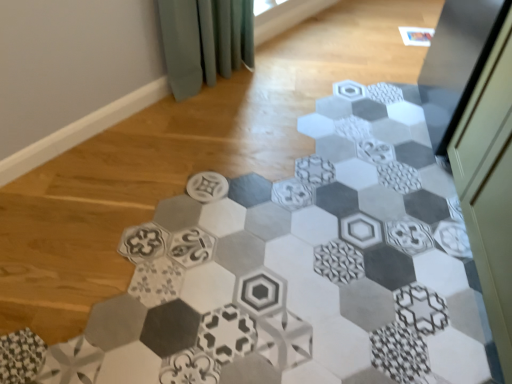
Identify the location of vacant area to the right of white glossy picture frame at upper right. Image resolution: width=512 pixels, height=384 pixels. (457, 41).